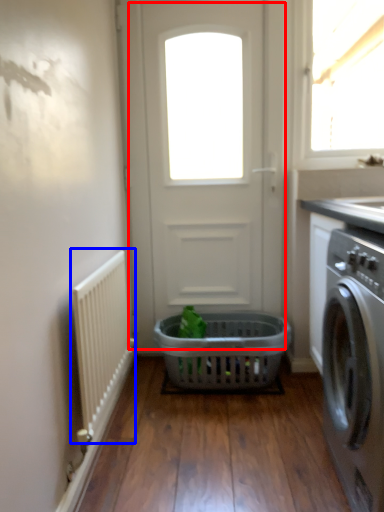
Question: Which object appears closest to the camera in this image, door (highlighted by a red box) or radiator (highlighted by a blue box)?

Choices:
 (A) door
 (B) radiator

Answer: (B)